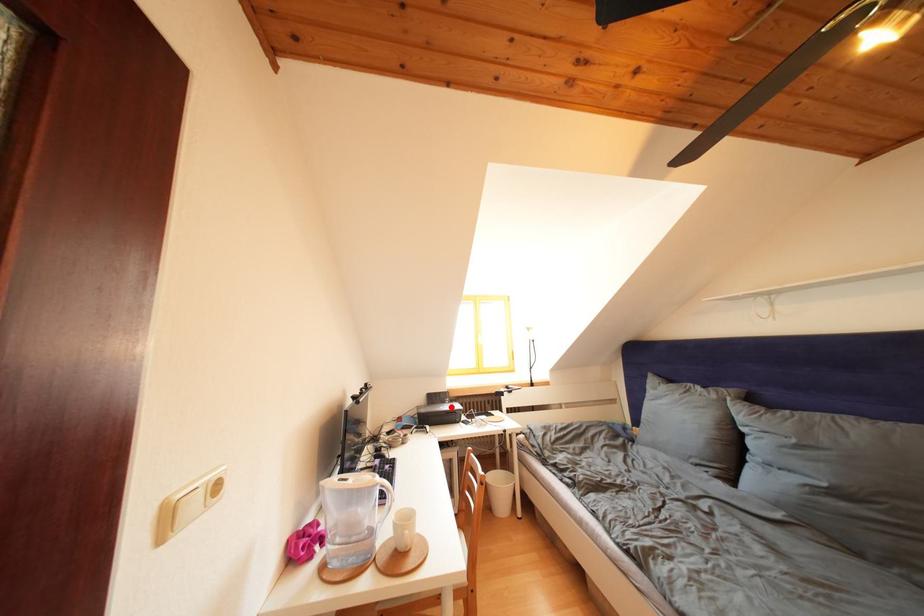
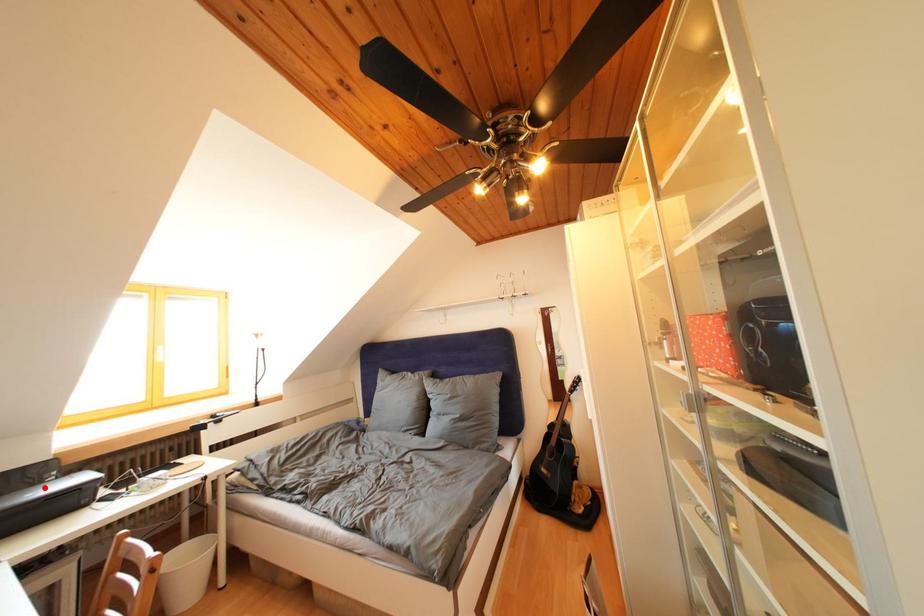
I am providing you with two images of the same scene from different viewpoints. A red point is marked on the first image and another point is marked on the second image. Is the marked point in image1 the same physical position as the marked point in image2?

Yes